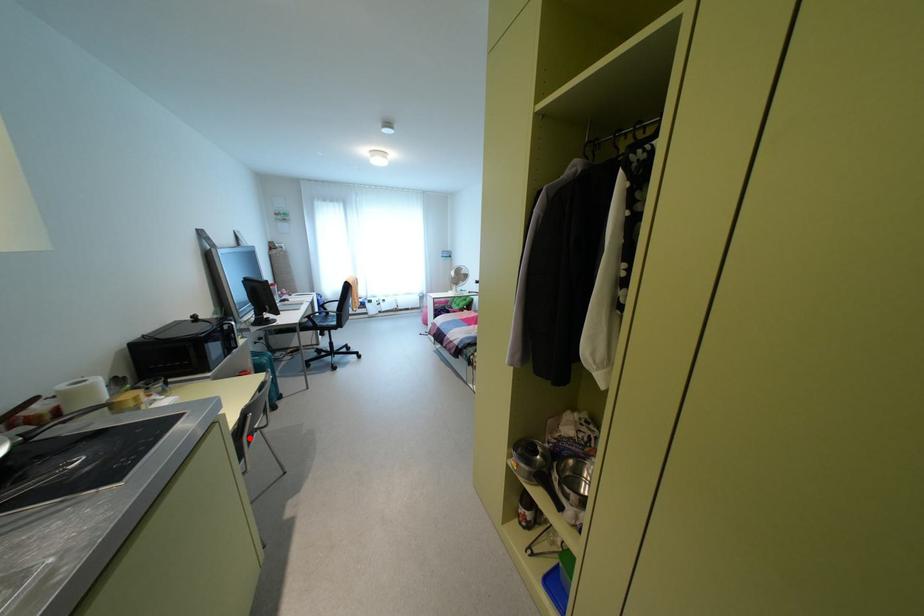
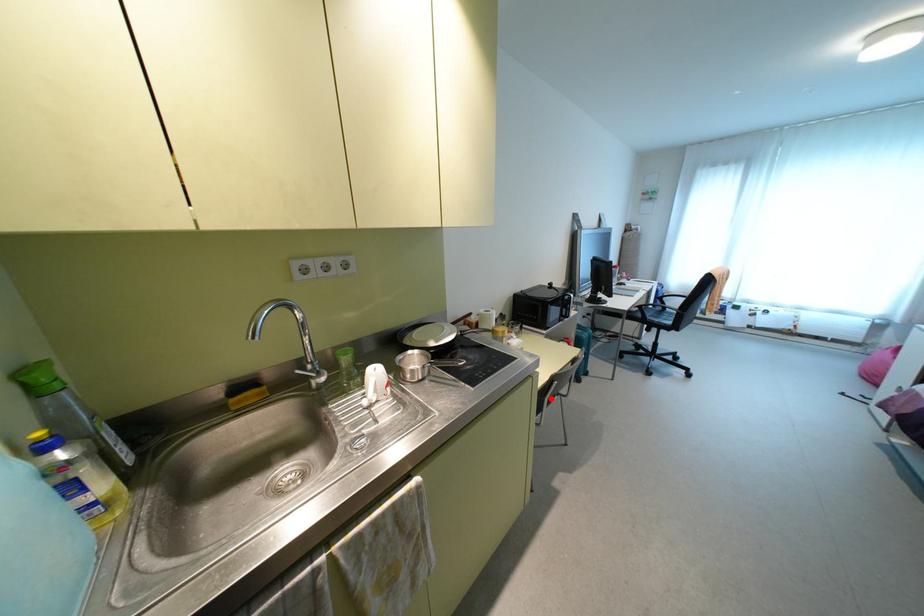
I am providing you with two images of the same scene from different viewpoints. A red point is marked on the first image and another point is marked on the second image. Are the points marked in image1 and image2 representing the same 3D position?

Yes